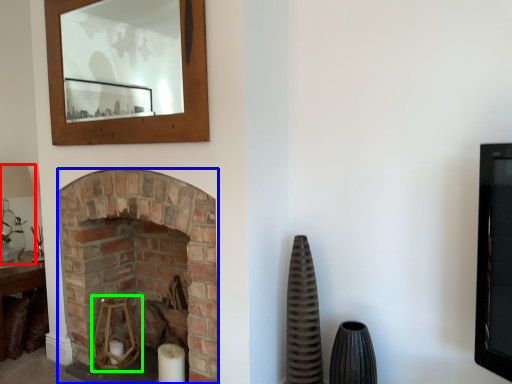
Question: Which object is the closest to the lamp (highlighted by a red box)? Choose among these: fireplace (highlighted by a blue box) or candle holder (highlighted by a green box).

Choices:
 (A) fireplace
 (B) candle holder

Answer: (B)